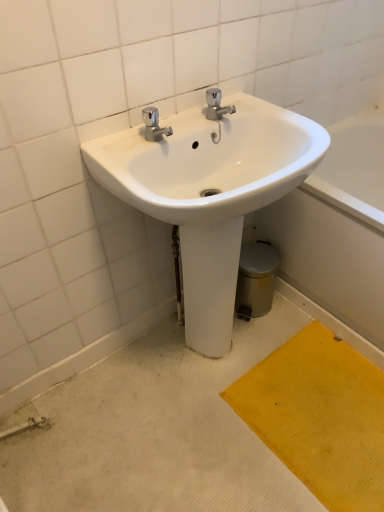
Question: Does white glossy bath at lower right lie in front of yellow textured mat at lower right?

Choices:
 (A) yes
 (B) no

Answer: (B)

Question: From a real-world perspective, is white glossy bath at lower right positioned over yellow textured mat at lower right based on gravity?

Choices:
 (A) no
 (B) yes

Answer: (B)

Question: Considering the relative sizes of white glossy bath at lower right and yellow textured mat at lower right in the image provided, is white glossy bath at lower right thinner than yellow textured mat at lower right?

Choices:
 (A) yes
 (B) no

Answer: (B)

Question: Considering the relative sizes of white glossy bath at lower right and yellow textured mat at lower right in the image provided, is white glossy bath at lower right shorter than yellow textured mat at lower right?

Choices:
 (A) yes
 (B) no

Answer: (B)

Question: Could you tell me if white glossy bath at lower right is turned towards yellow textured mat at lower right?

Choices:
 (A) no
 (B) yes

Answer: (B)

Question: Is white glossy bath at lower right wider than yellow textured mat at lower right?

Choices:
 (A) no
 (B) yes

Answer: (B)

Question: Is white glossy bath at lower right next to white glossy sink at center and touching it?

Choices:
 (A) no
 (B) yes

Answer: (A)

Question: Is white glossy sink at center at the back of white glossy bath at lower right?

Choices:
 (A) no
 (B) yes

Answer: (A)

Question: Considering the relative sizes of white glossy bath at lower right and white glossy sink at center in the image provided, is white glossy bath at lower right wider than white glossy sink at center?

Choices:
 (A) yes
 (B) no

Answer: (A)

Question: Considering the relative sizes of white glossy bath at lower right and white glossy sink at center in the image provided, is white glossy bath at lower right shorter than white glossy sink at center?

Choices:
 (A) no
 (B) yes

Answer: (B)

Question: Can you confirm if white glossy bath at lower right is positioned to the right of white glossy sink at center?

Choices:
 (A) no
 (B) yes

Answer: (B)

Question: Is white glossy bath at lower right bigger than white glossy sink at center?

Choices:
 (A) no
 (B) yes

Answer: (B)

Question: Is yellow textured mat at lower right positioned before white glossy sink at center?

Choices:
 (A) yes
 (B) no

Answer: (B)